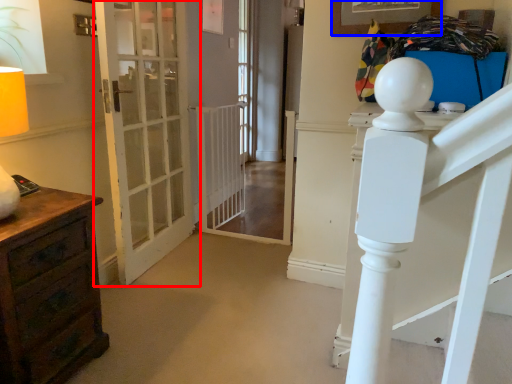
Question: Among these objects, which one is farthest to the camera, door (highlighted by a red box) or picture frame (highlighted by a blue box)?

Choices:
 (A) door
 (B) picture frame

Answer: (A)